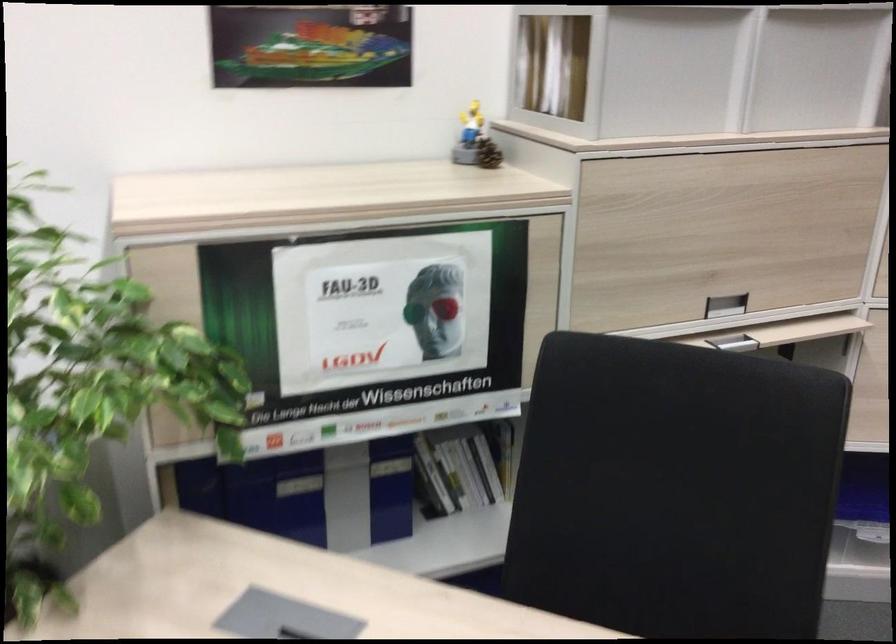
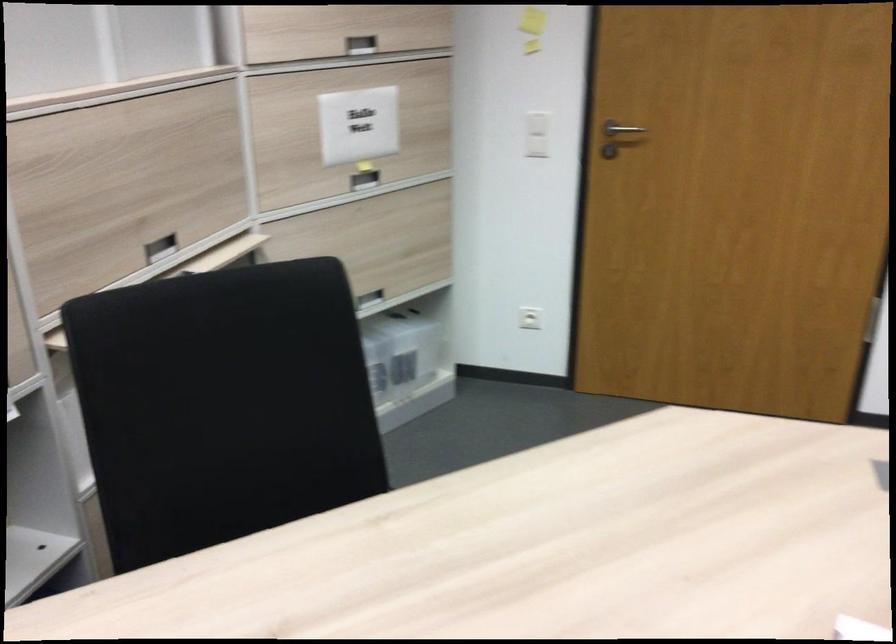
Question: Based on the continuous images, in which direction is the camera rotating? Reply with the corresponding letter.

Choices:
 (A) Left
 (B) Right
 (C) Up
 (D) Down

Answer: (B)